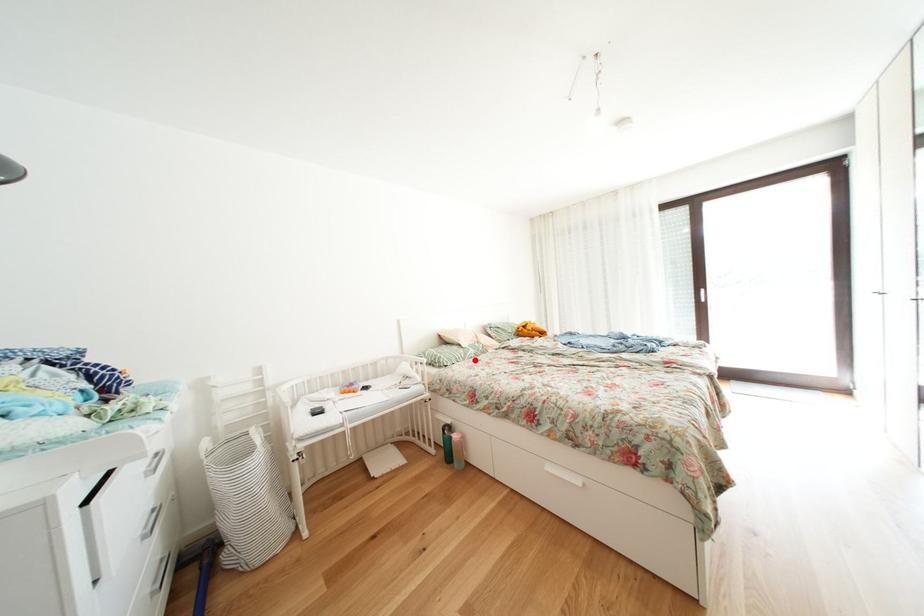
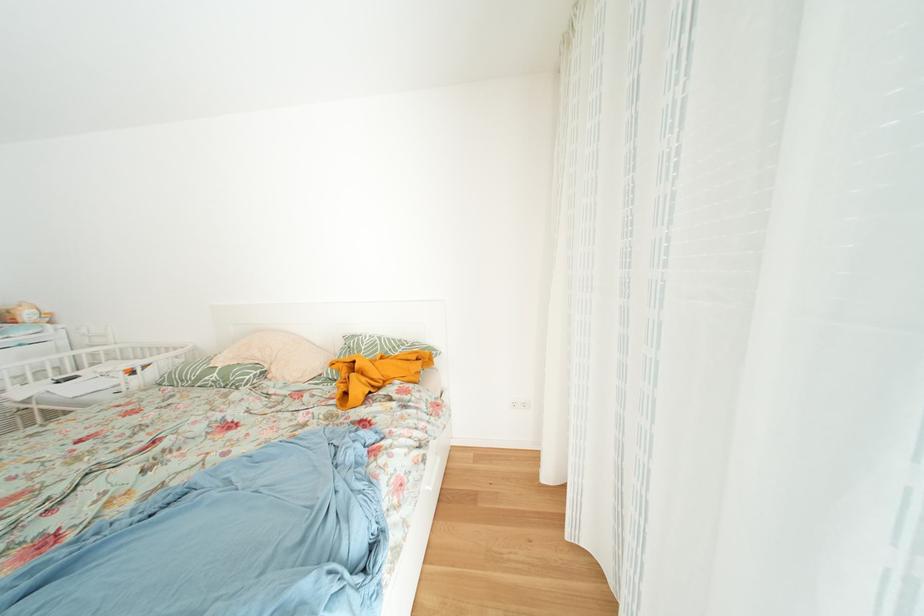
Where in the second image is the point corresponding to the highlighted location from the first image?

(208, 384)